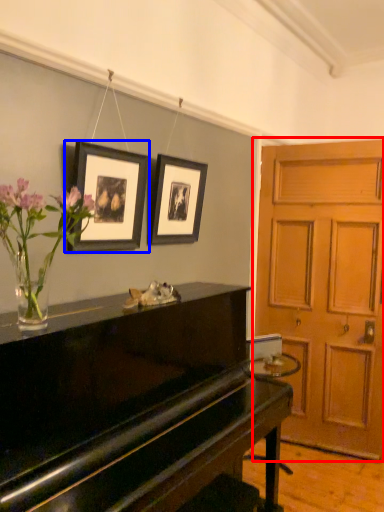
Question: Which of the following is the farthest to the observer, door (highlighted by a red box) or picture frame (highlighted by a blue box)?

Choices:
 (A) door
 (B) picture frame

Answer: (A)